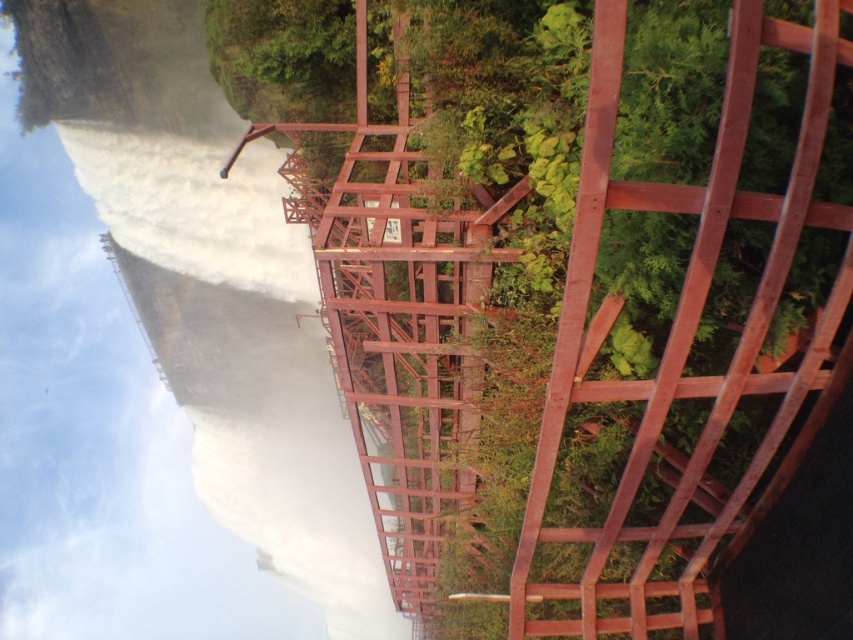
From the picture: You are a hiker planning to cross the rusty metal bridge at upper center near the waterfall. You notice white mist at left nearby. Considering the height difference between them, which one is higher from the ground?

The white mist at left is taller than the rusty metal bridge at upper center, so the white mist at left is higher from the ground.

You are a park ranger assessing safety conditions. You observe the rusty metal bridge at upper center and the white mist at left in the waterfall area. Which object is narrower in width?

The rusty metal bridge at upper center has a lesser width compared to the white mist at left, so the rusty metal bridge at upper center is narrower.

You are a hiker planning to cross the rusty metal bridge at upper center to get closer to the waterfall. However, you notice the white mist at left. Based on the scene description, can you determine if the mist is below or above the bridge?

The rusty metal bridge at upper center is located above the white mist at left, so the mist is below the bridge.